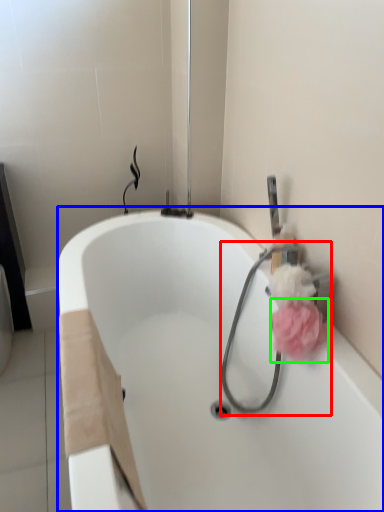
Question: Which object is positioned farthest from garden hose (highlighted by a red box)? Select from bathtub (highlighted by a blue box) and flower (highlighted by a green box).

Choices:
 (A) bathtub
 (B) flower

Answer: (A)